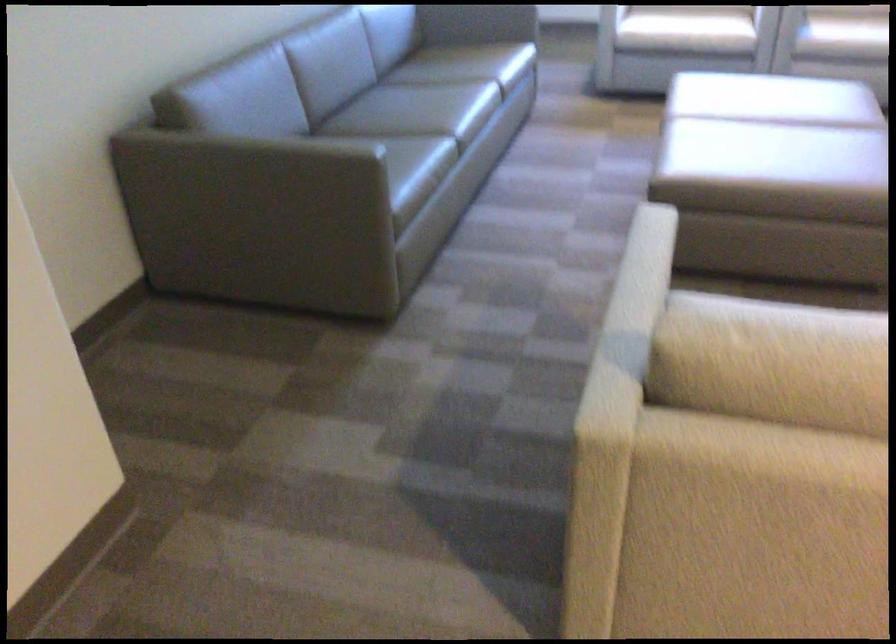
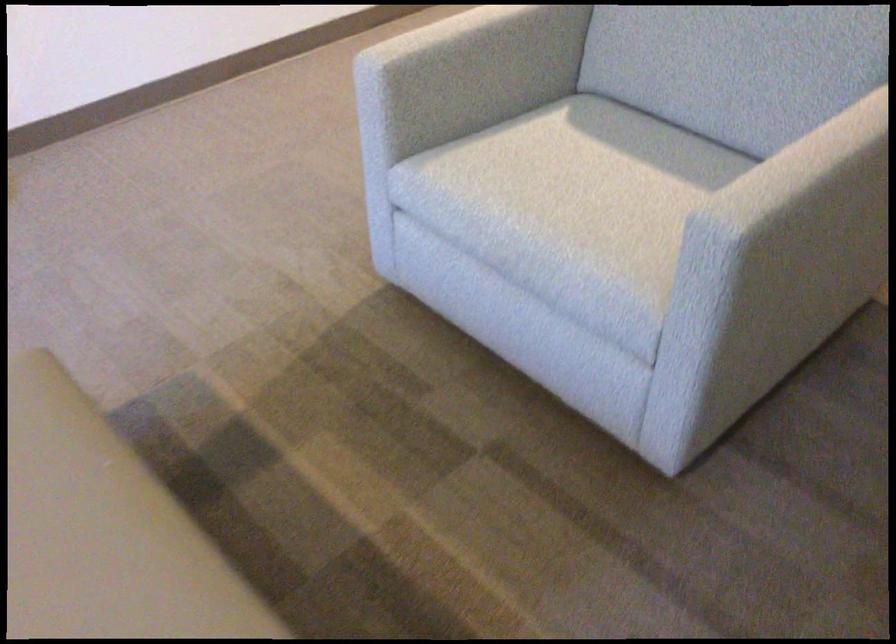
Where in the second image is the point corresponding to the point at 644,252 from the first image?

(780, 178)